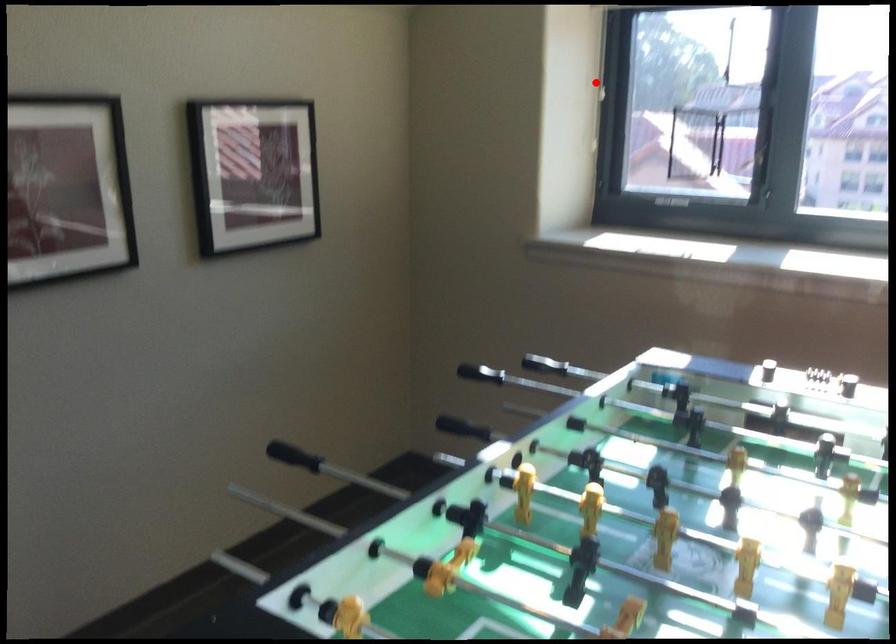
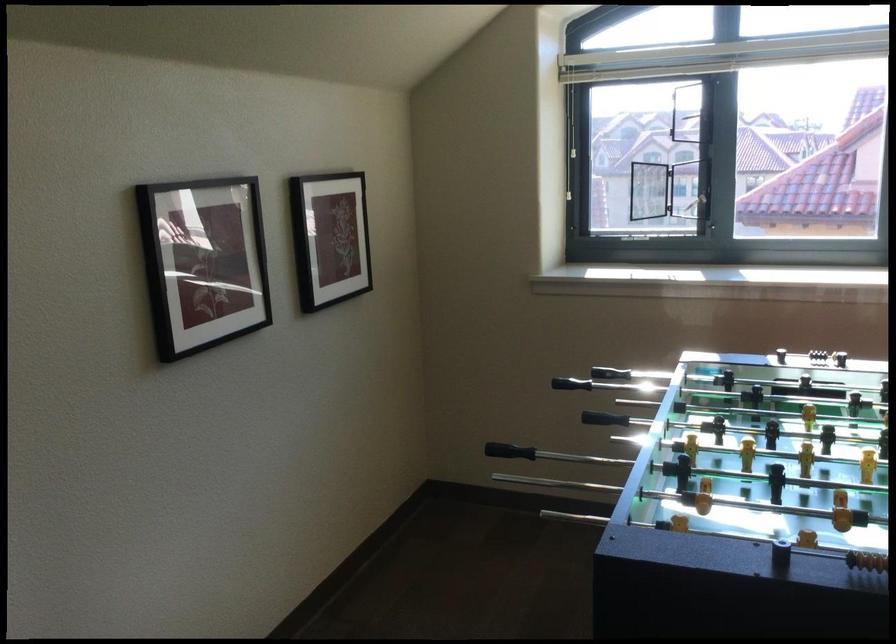
Question: I am providing you with two images of the same scene from different viewpoints. In image1, a red point is highlighted. Considering the same 3D point in image2, which of the following is correct?

Choices:
 (A) It is closer
 (B) It is farther

Answer: (B)